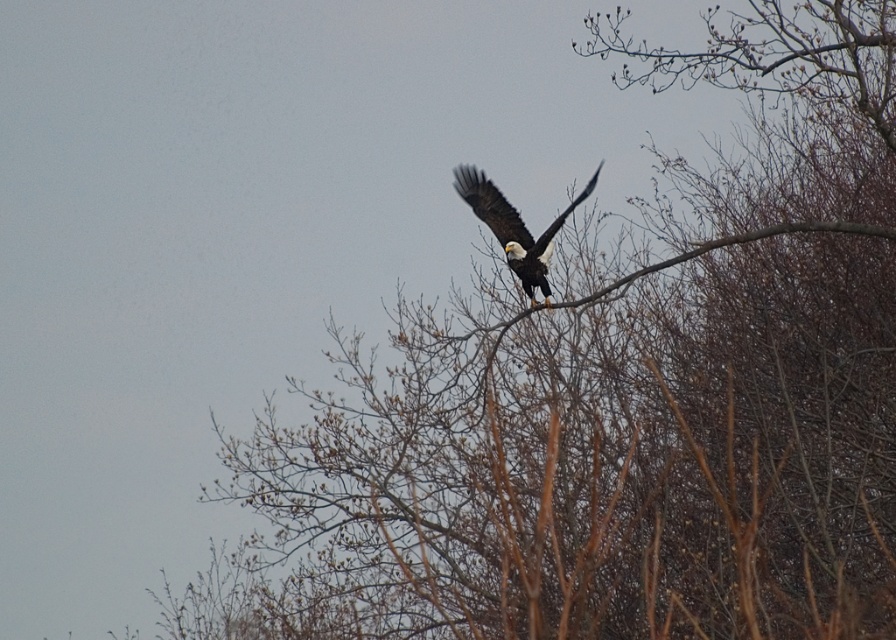
Is white-feathered bald eagle at center above brown wood tree branch at center?

Yes.

Does white-feathered bald eagle at center have a smaller size compared to brown wood tree branch at center?

Indeed, white-feathered bald eagle at center has a smaller size compared to brown wood tree branch at center.

Describe the element at coordinates (514, 227) in the screenshot. I see `white-feathered bald eagle at center` at that location.

The image size is (896, 640). Find the location of `white-feathered bald eagle at center`. white-feathered bald eagle at center is located at coordinates (514, 227).